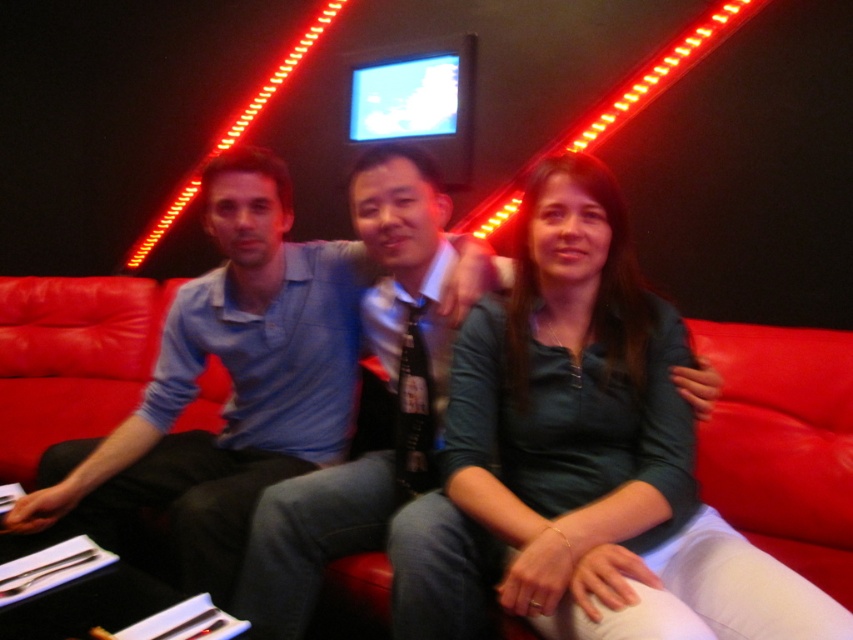
Does blue shirt at center appear on the right side of red leather couch at center?

Yes, blue shirt at center is to the right of red leather couch at center.

Does point (236, 276) lie in front of point (73, 285)?

Yes.

Is point (231, 198) in front of point (32, 285)?

Yes, it is.

Identify the location of blue shirt at center. Image resolution: width=853 pixels, height=640 pixels. (231, 385).

Does matte green shirt at center appear over red leather couch at center?

Yes.

Is matte green shirt at center bigger than red leather couch at center?

No.

Is point (543, 588) closer to camera compared to point (814, 577)?

That is True.

Identify the location of matte green shirt at center. The height and width of the screenshot is (640, 853). (577, 448).

Which of these two, matte green shirt at center or blue shirt at center, stands shorter?

With less height is matte green shirt at center.

Does matte green shirt at center have a larger size compared to blue shirt at center?

No, matte green shirt at center is not bigger than blue shirt at center.

Where is `matte green shirt at center`? The image size is (853, 640). matte green shirt at center is located at coordinates (577, 448).